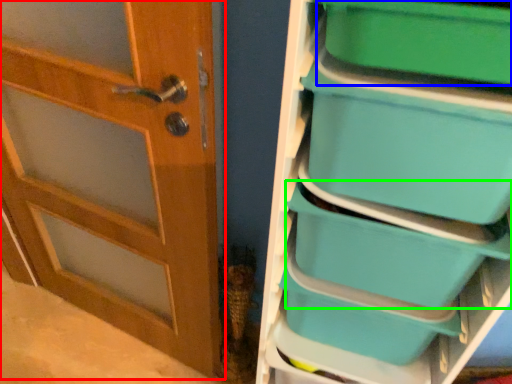
Question: Which object is positioned closest to door (highlighted by a red box)? Select from storage box (highlighted by a blue box) and storage box (highlighted by a green box).

Choices:
 (A) storage box
 (B) storage box

Answer: (B)